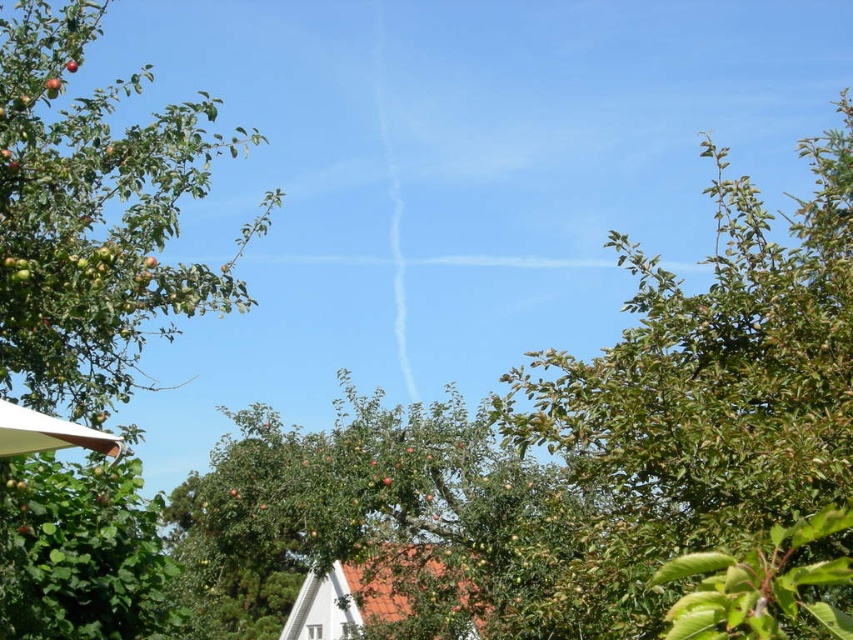
Question: Is ripe red apple at upper left further to camera compared to ripe red apple at center?

Choices:
 (A) no
 (B) yes

Answer: (A)

Question: Is green leafy tree at upper right below ripe red apple at center?

Choices:
 (A) yes
 (B) no

Answer: (A)

Question: Which object is positioned closest to the green leafy tree at upper right?

Choices:
 (A) ripe red apple at center
 (B) ripe red apple at upper left

Answer: (B)

Question: Does green leafy tree at upper right have a larger size compared to ripe red apple at center?

Choices:
 (A) yes
 (B) no

Answer: (A)

Question: Among these points, which one is farthest from the camera?

Choices:
 (A) (64, 65)
 (B) (606, 604)
 (C) (57, 86)

Answer: (A)

Question: Which of the following is the farthest from the observer?

Choices:
 (A) (741, 365)
 (B) (54, 81)
 (C) (77, 61)

Answer: (C)